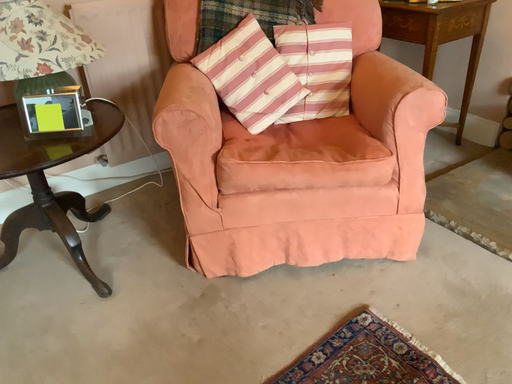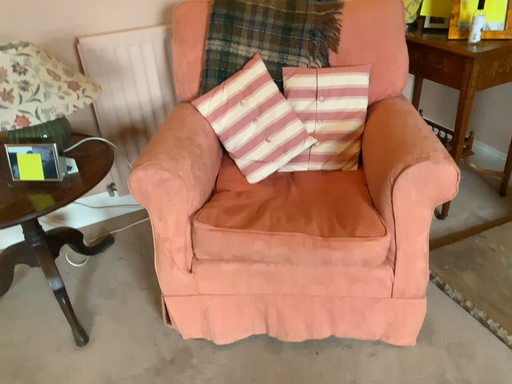
Question: Which way did the camera rotate in the video?

Choices:
 (A) rotated left
 (B) rotated right

Answer: (A)